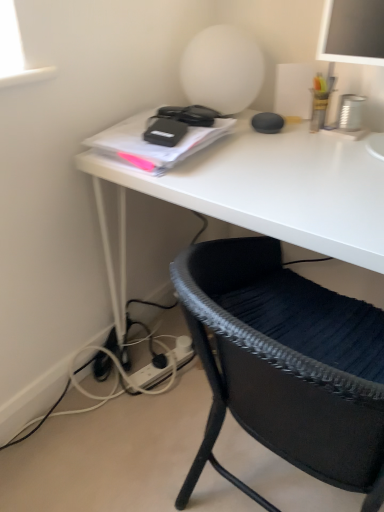
This screenshot has height=512, width=384. Identify the location of white matte desk at center. (264, 194).

Image resolution: width=384 pixels, height=512 pixels. What do you see at coordinates (286, 365) in the screenshot?
I see `black woven chair at lower right` at bounding box center [286, 365].

What are the coordinates of `white plastic plug at lower center` in the screenshot? It's located at (151, 375).

Does black woven chair at lower right have a lesser height compared to white plastic plug at lower center?

No.

From a real-world perspective, between black woven chair at lower right and white plastic plug at lower center, who is vertically higher?

In real-world perspective, black woven chair at lower right is above.

How many degrees apart are the facing directions of black woven chair at lower right and white plastic plug at lower center?

The angle between the facing direction of black woven chair at lower right and the facing direction of white plastic plug at lower center is 102 degrees.

Measure the distance between black woven chair at lower right and white plastic plug at lower center.

black woven chair at lower right and white plastic plug at lower center are 23.88 inches apart.

From the image's perspective, which one is positioned higher, white plastic plug at lower center or black woven chair at lower right?

black woven chair at lower right.

Which is closer to the camera, (183, 362) or (303, 431)?

Point (183, 362) is positioned farther from the camera compared to point (303, 431).

From a real-world perspective, is white plastic plug at lower center positioned above or below black woven chair at lower right?

Answer: From a real-world perspective, white plastic plug at lower center is physically below black woven chair at lower right.

Considering the sizes of white plastic plug at lower center and black woven chair at lower right in the image, is white plastic plug at lower center taller or shorter than black woven chair at lower right?

Clearly, white plastic plug at lower center is shorter compared to black woven chair at lower right.

Would you say black woven chair at lower right is part of white matte desk at center's contents?

Yes, black woven chair at lower right is inside white matte desk at center.

The image size is (384, 512). Identify the location of desk to the left of black woven chair at lower right. (264, 194).

Can you confirm if white matte desk at center is positioned to the left of black woven chair at lower right?

Indeed, white matte desk at center is positioned on the left side of black woven chair at lower right.

Could you tell me if white plastic plug at lower center is facing white matte desk at center?

Yes, white plastic plug at lower center is oriented towards white matte desk at center.

Looking at this image, how much distance is there between white plastic plug at lower center and white matte desk at center?

white plastic plug at lower center and white matte desk at center are 22.53 inches apart from each other.

Which of these two, white plastic plug at lower center or white matte desk at center, is wider?

With larger width is white matte desk at center.

Is white plastic plug at lower center in front of or behind white matte desk at center in the image?

In the image, white plastic plug at lower center appears behind white matte desk at center.

Considering the sizes of black woven chair at lower right and white matte desk at center in the image, is black woven chair at lower right wider or thinner than white matte desk at center?

In the image, black woven chair at lower right appears to be more narrow than white matte desk at center.

In the scene shown: Who is shorter, black woven chair at lower right or white matte desk at center?

black woven chair at lower right is shorter.

Considering the relative positions of black woven chair at lower right and white matte desk at center in the image provided, is black woven chair at lower right in front of white matte desk at center?

Yes, it is.

From the image's perspective, is white matte desk at center above or below white plastic plug at lower center?

white matte desk at center is situated higher than white plastic plug at lower center in the image.

Would you say white matte desk at center is a long distance from white plastic plug at lower center?

white matte desk at center is actually quite close to white plastic plug at lower center.

From a real-world perspective, who is located higher, white matte desk at center or white plastic plug at lower center?

white matte desk at center is physically above.

Can you confirm if white matte desk at center is taller than white plastic plug at lower center?

Correct, white matte desk at center is much taller as white plastic plug at lower center.

You are a GUI agent. You are given a task and a screenshot of the screen. Output one action in this format:
    pyautogui.click(x=<x>, y=<y>)
    Task: Click on the chair above the white plastic plug at lower center (from a real-world perspective)
    The width and height of the screenshot is (384, 512).
    Given the screenshot: What is the action you would take?
    pyautogui.click(x=286, y=365)

Identify the location of plug below the black woven chair at lower right (from the image's perspective). (151, 375).

Based on their spatial positions, is white plastic plug at lower center or white matte desk at center further from black woven chair at lower right?

The object further to black woven chair at lower right is white plastic plug at lower center.

Based on their spatial positions, is black woven chair at lower right or white plastic plug at lower center further from white matte desk at center?

white plastic plug at lower center is further to white matte desk at center.

Looking at the image, which one is located further to white plastic plug at lower center, black woven chair at lower right or white matte desk at center?

Based on the image, black woven chair at lower right appears to be further to white plastic plug at lower center.

Consider the image. Which object lies further to the anchor point white matte desk at center, white plastic plug at lower center or black woven chair at lower right?

Among the two, white plastic plug at lower center is located further to white matte desk at center.

Considering their positions, is white matte desk at center positioned closer to white plastic plug at lower center than black woven chair at lower right?

Among the two, white matte desk at center is located nearer to white plastic plug at lower center.

Based on their spatial positions, is white matte desk at center or white plastic plug at lower center closer to black woven chair at lower right?

Based on the image, white matte desk at center appears to be nearer to black woven chair at lower right.

Locate an element on the screen. The height and width of the screenshot is (512, 384). desk located between black woven chair at lower right and white plastic plug at lower center in the depth direction is located at coordinates (264, 194).